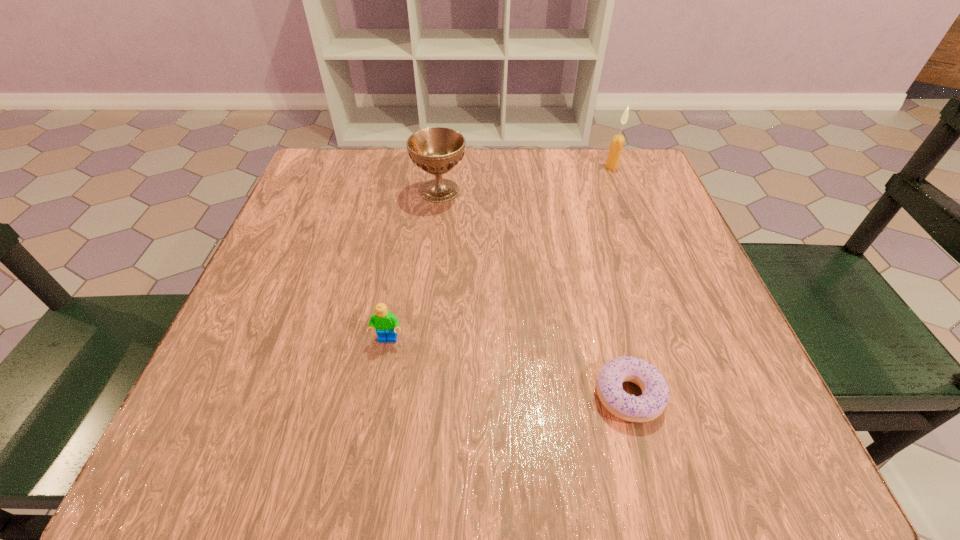
This screenshot has height=540, width=960. Identify the location of free space at the left edge of the desktop. pyautogui.click(x=230, y=391).

The height and width of the screenshot is (540, 960). I want to click on blank space at the right edge of the desktop, so click(710, 318).

Find the location of a particular element. The image size is (960, 540). vacant space at the near left corner of the desktop is located at coordinates pos(177,447).

Image resolution: width=960 pixels, height=540 pixels. In the image, there is a desktop. In order to click on vacant space at the far right corner in this screenshot , I will do `click(644, 202)`.

The width and height of the screenshot is (960, 540). I want to click on free space at the near right corner of the desktop, so click(681, 462).

This screenshot has height=540, width=960. Identify the location of empty space between the rightmost object and the nearest object. (620, 281).

Identify the location of free space between the shortest object and the third farthest object. The height and width of the screenshot is (540, 960). (508, 367).

This screenshot has width=960, height=540. I want to click on free space between the second farthest object and the shortest object, so click(534, 293).

You are a GUI agent. You are given a task and a screenshot of the screen. Output one action in this format:
    pyautogui.click(x=<x>, y=<y>)
    Task: Click on the empty location between the rightmost object and the second farthest object
    
    Given the screenshot: What is the action you would take?
    pyautogui.click(x=526, y=179)

The image size is (960, 540). Find the location of `free space between the candle and the chalice`. free space between the candle and the chalice is located at coordinates (526, 179).